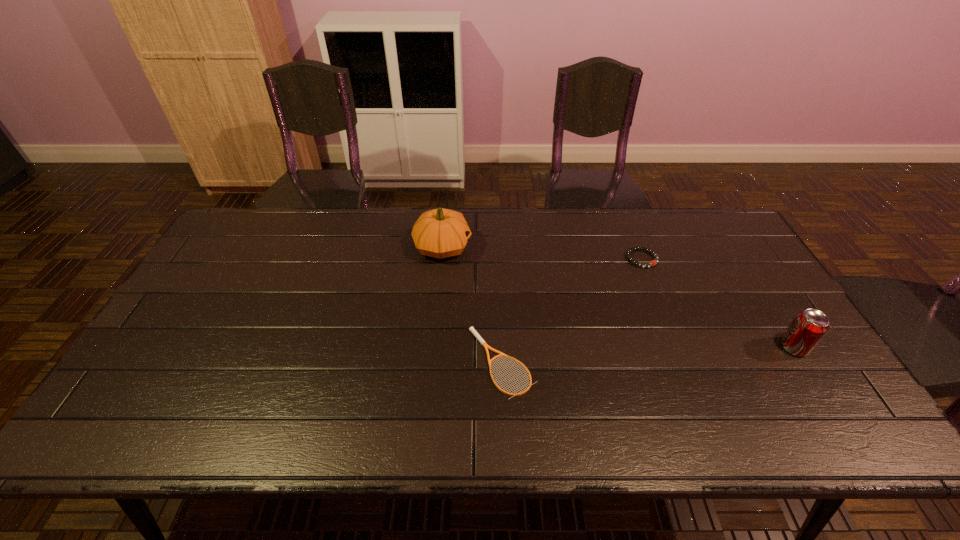
You are a GUI agent. You are given a task and a screenshot of the screen. Output one action in this format:
    pyautogui.click(x=<x>, y=<y>)
    Task: Click on the vacant region that satisfies the following two spatial constraints: 1. on the side of the tallest object with the carved face; 2. on the back side of the tennis racket
    This screenshot has height=540, width=960.
    Given the screenshot: What is the action you would take?
    pyautogui.click(x=432, y=362)

Locate an element on the screen. This screenshot has height=540, width=960. vacant point that satisfies the following two spatial constraints: 1. on the side of the tallest object with the carved face; 2. on the back side of the third tallest object is located at coordinates (442, 259).

Where is `free spot that satisfies the following two spatial constraints: 1. on the side of the gourd with the carved face; 2. on the left side of the tennis racket`? Image resolution: width=960 pixels, height=540 pixels. free spot that satisfies the following two spatial constraints: 1. on the side of the gourd with the carved face; 2. on the left side of the tennis racket is located at coordinates (432, 362).

The width and height of the screenshot is (960, 540). I want to click on free space that satisfies the following two spatial constraints: 1. on the front side of the bracelet; 2. on the right side of the second tallest object, so click(677, 347).

The height and width of the screenshot is (540, 960). Find the location of `free space in the image that satisfies the following two spatial constraints: 1. on the side of the tallest object with the carved face; 2. on the back side of the shortest object`. free space in the image that satisfies the following two spatial constraints: 1. on the side of the tallest object with the carved face; 2. on the back side of the shortest object is located at coordinates click(x=432, y=362).

At what (x,y) coordinates should I click in order to perform the action: click on free spot that satisfies the following two spatial constraints: 1. on the back side of the rightmost object; 2. on the side of the gourd with the carved face. Please return your answer as a coordinate pair (x, y). The image size is (960, 540). Looking at the image, I should click on (731, 247).

Find the location of `vacant space that satisfies the following two spatial constraints: 1. on the side of the shortest object with the carved face; 2. on the right side of the gourd`. vacant space that satisfies the following two spatial constraints: 1. on the side of the shortest object with the carved face; 2. on the right side of the gourd is located at coordinates (432, 362).

Where is `vacant space that satisfies the following two spatial constraints: 1. on the side of the tennis racket with the carved face; 2. on the right side of the gourd`? vacant space that satisfies the following two spatial constraints: 1. on the side of the tennis racket with the carved face; 2. on the right side of the gourd is located at coordinates (432, 362).

Where is `vacant space that satisfies the following two spatial constraints: 1. on the back side of the shortest object; 2. on the right side of the second shortest object`? The width and height of the screenshot is (960, 540). vacant space that satisfies the following two spatial constraints: 1. on the back side of the shortest object; 2. on the right side of the second shortest object is located at coordinates (497, 259).

Where is `vacant point that satisfies the following two spatial constraints: 1. on the side of the rightmost object with the carved face; 2. on the left side of the tallest object`? This screenshot has height=540, width=960. vacant point that satisfies the following two spatial constraints: 1. on the side of the rightmost object with the carved face; 2. on the left side of the tallest object is located at coordinates (433, 347).